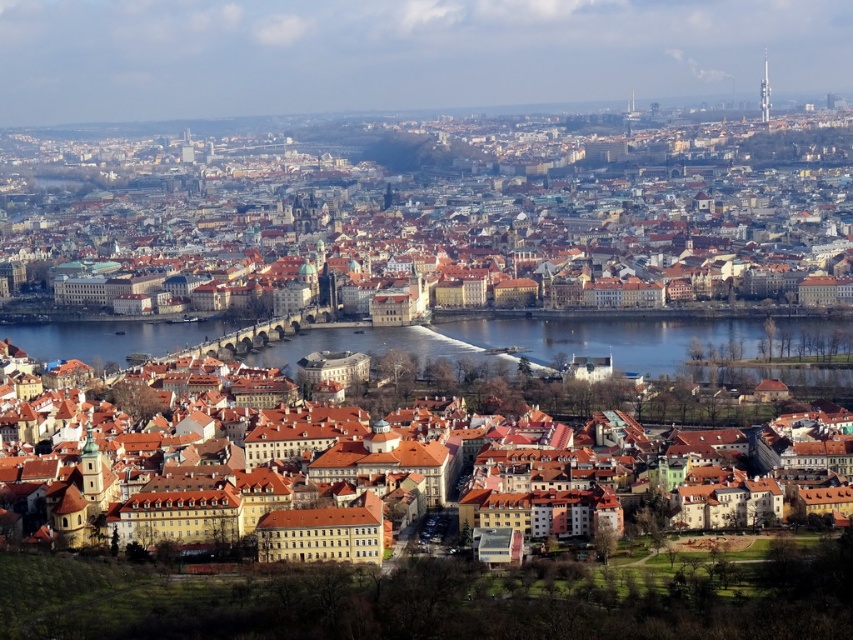
Question: Is brown tiled roofs at center to the right of blue water at center from the viewer's perspective?

Choices:
 (A) yes
 (B) no

Answer: (B)

Question: Is brown tiled roofs at center behind brown textured buildings at center?

Choices:
 (A) no
 (B) yes

Answer: (B)

Question: Which of the following is the closest to the observer?

Choices:
 (A) (660, 161)
 (B) (552, 401)

Answer: (B)

Question: Estimate the real-world distances between objects in this image. Which object is closer to the blue water at center?

Choices:
 (A) brown textured buildings at center
 (B) brown tiled roofs at center

Answer: (A)

Question: Observing the image, what is the correct spatial positioning of blue water at center in reference to brown textured buildings at center?

Choices:
 (A) left
 (B) right

Answer: (A)

Question: Considering the real-world distances, which object is farthest from the brown textured buildings at center?

Choices:
 (A) brown tiled roofs at center
 (B) blue water at center

Answer: (A)